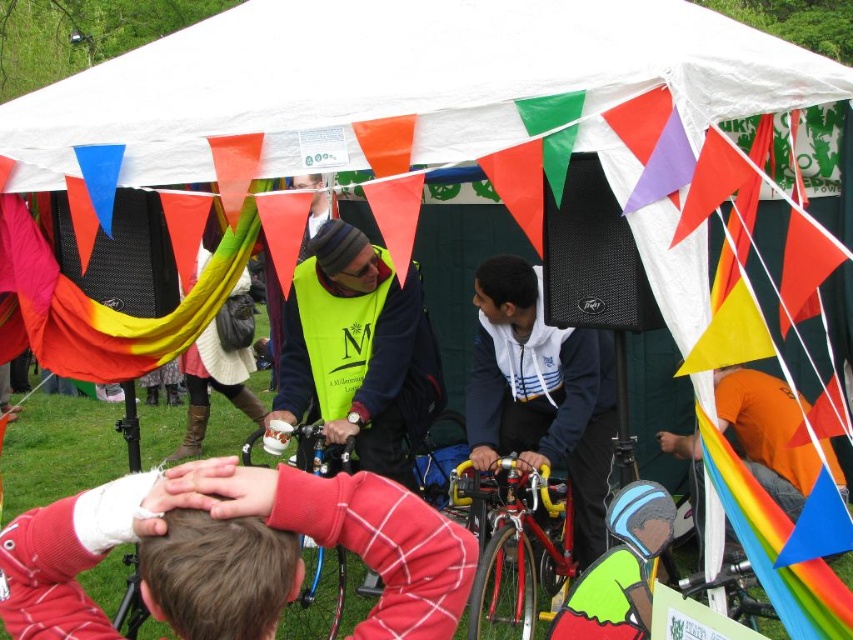
You are planning to hang a banner under the white fabric canopy at upper center and the red plaid shirt at center. Which object has a larger width to accommodate the banner?

The white fabric canopy at upper center has a larger width than the red plaid shirt at center, so it can accommodate the banner better.

You are a delivery robot with a 1.5 meter wide package. You need to pass between the white fabric canopy at upper center and the red plaid shirt at center to reach the delivery point. Can you fit through the space?

The distance between the white fabric canopy at upper center and the red plaid shirt at center is 1.69 meters. Since your package is 1.5 meters wide, you can fit through the space as the available width is greater than the package width.

You are standing at the point marked by the coordinates (x=231, y=552) in the image. What object is exactly at this location?

The red plaid shirt at center is located at point (x=231, y=552).